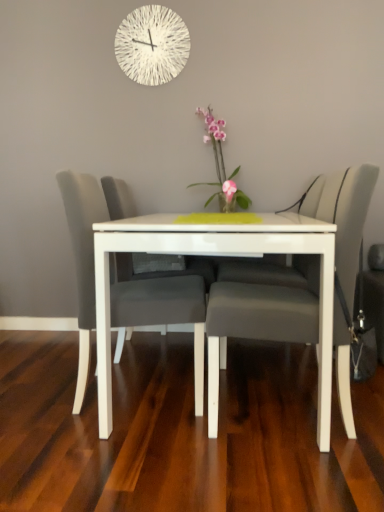
This screenshot has height=512, width=384. What are the coordinates of `free space in front of matte gray chair at center, the first chair viewed from the right` in the screenshot? It's located at (280, 476).